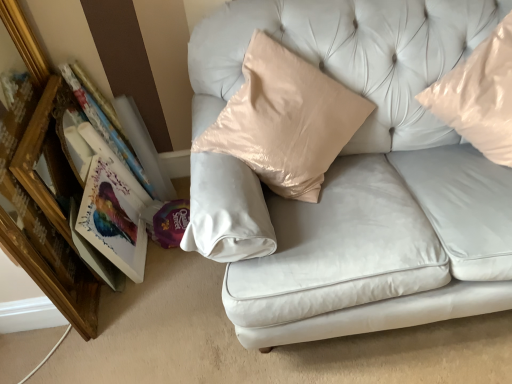
Question: Is wooden picture frame at left bigger than matte paper book at left?

Choices:
 (A) yes
 (B) no

Answer: (A)

Question: From a real-world perspective, does wooden picture frame at left sit lower than matte paper book at left?

Choices:
 (A) no
 (B) yes

Answer: (A)

Question: Is wooden picture frame at left to the right of matte paper book at left from the viewer's perspective?

Choices:
 (A) no
 (B) yes

Answer: (A)

Question: Is wooden picture frame at left facing away from matte paper book at left?

Choices:
 (A) no
 (B) yes

Answer: (B)

Question: Is wooden picture frame at left taller than matte paper book at left?

Choices:
 (A) no
 (B) yes

Answer: (B)

Question: From their relative heights in the image, would you say glossy plastic pillow at upper right is taller or shorter than wooden picture frame at left?

Choices:
 (A) tall
 (B) short

Answer: (B)

Question: Relative to wooden picture frame at left, is glossy plastic pillow at upper right in front or behind?

Choices:
 (A) front
 (B) behind

Answer: (A)

Question: Is point (434, 91) closer or farther from the camera than point (5, 8)?

Choices:
 (A) farther
 (B) closer

Answer: (A)

Question: In terms of size, does glossy plastic pillow at upper right appear bigger or smaller than wooden picture frame at left?

Choices:
 (A) big
 (B) small

Answer: (A)

Question: Visually, is wooden picture frame at left positioned to the left or to the right of matte paper book at left?

Choices:
 (A) right
 (B) left

Answer: (B)

Question: Based on their sizes in the image, would you say wooden picture frame at left is bigger or smaller than matte paper book at left?

Choices:
 (A) small
 (B) big

Answer: (B)

Question: Considering the positions of wooden picture frame at left and matte paper book at left in the image, is wooden picture frame at left wider or thinner than matte paper book at left?

Choices:
 (A) thin
 (B) wide

Answer: (B)

Question: Relative to matte paper book at left, is wooden picture frame at left in front or behind?

Choices:
 (A) behind
 (B) front

Answer: (B)

Question: Looking at their shapes, would you say matte cardboard book at left is wider or thinner than satin white couch at center?

Choices:
 (A) wide
 (B) thin

Answer: (B)

Question: Considering the positions of matte cardboard book at left and satin white couch at center in the image, is matte cardboard book at left taller or shorter than satin white couch at center?

Choices:
 (A) tall
 (B) short

Answer: (A)